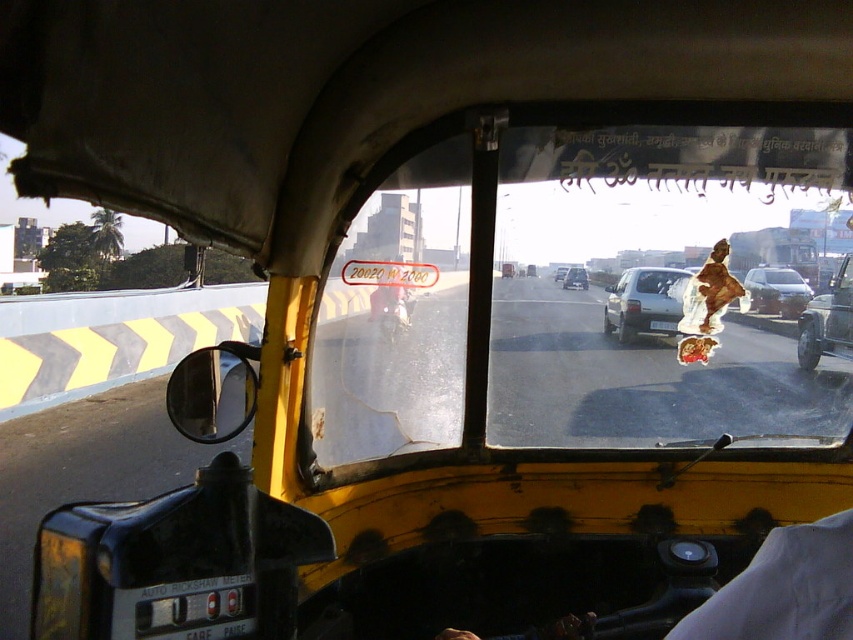
You are a passenger in the yellow auto rickshaw and notice two vehicles ahead. The matte silver car at center and the silver metallic sedan at center are both in your line of sight. Which one appears larger to you?

The matte silver car at center appears larger than the silver metallic sedan at center because it is bigger in size.

You are a passenger in the yellow auto rickshaw and you see a matte silver car at center and a silver metallic sedan at center. Which one is more to the right?

The matte silver car at center is positioned on the right side of the silver metallic sedan at center, so the matte silver car at center is more to the right.